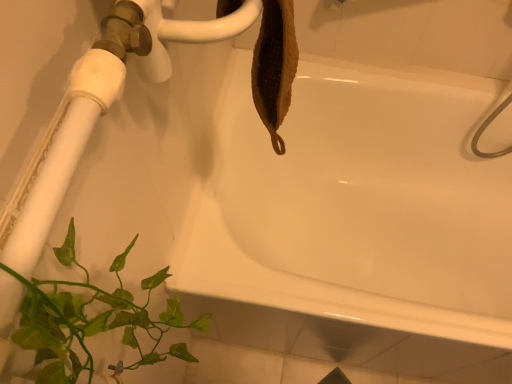
Image resolution: width=512 pixels, height=384 pixels. Describe the element at coordinates (364, 178) in the screenshot. I see `white glossy bathtub at upper center` at that location.

This screenshot has width=512, height=384. In order to click on white glossy bathtub at upper center in this screenshot , I will do `click(364, 178)`.

What are the coordinates of `white glossy bathtub at upper center` in the screenshot? It's located at (364, 178).